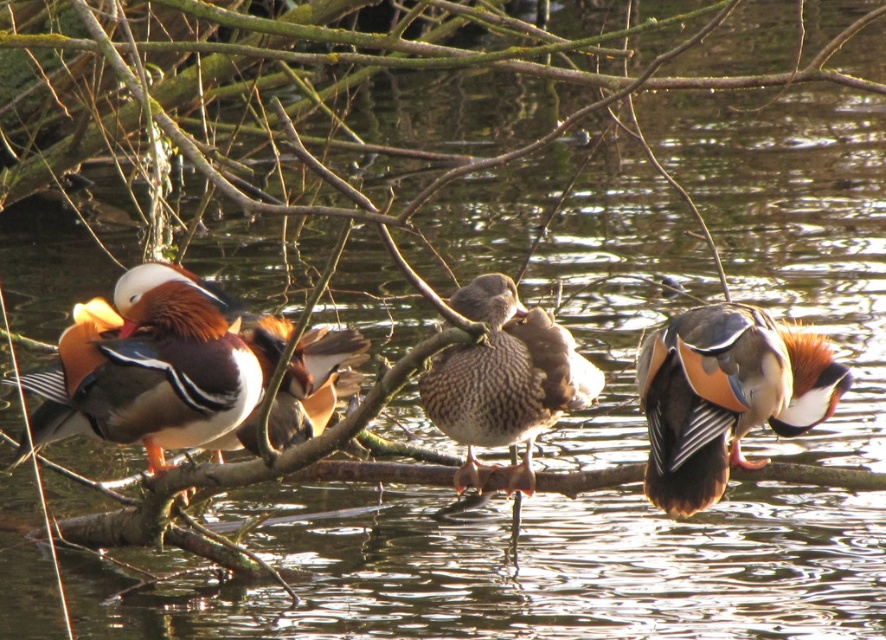
You are observing ducks resting on a branch above water. There are two points marked on the branch where the ducks are sitting. The points are labeled as point (253, 374) and point (320, 352). From your perspective, which point is closer to you?

Point (253, 374) is in front of point (320, 352), so it is closer to you.

You are observing a group of ducks on a branch above water. Where is the speckled feather duck at center located in terms of its 2D coordinates?

The speckled feather duck at center is located at the 2D coordinates point [504,378].

You are a photographer aiming to capture the shiny brown duck at left in your shot. The camera is positioned at the point with coordinates (158,365). Can you confirm if the camera is precisely focused on the shiny brown duck at left?

The point at coordinates (158,365) indicates the shiny brown duck at left, so yes, the camera is precisely focused on the shiny brown duck at left.